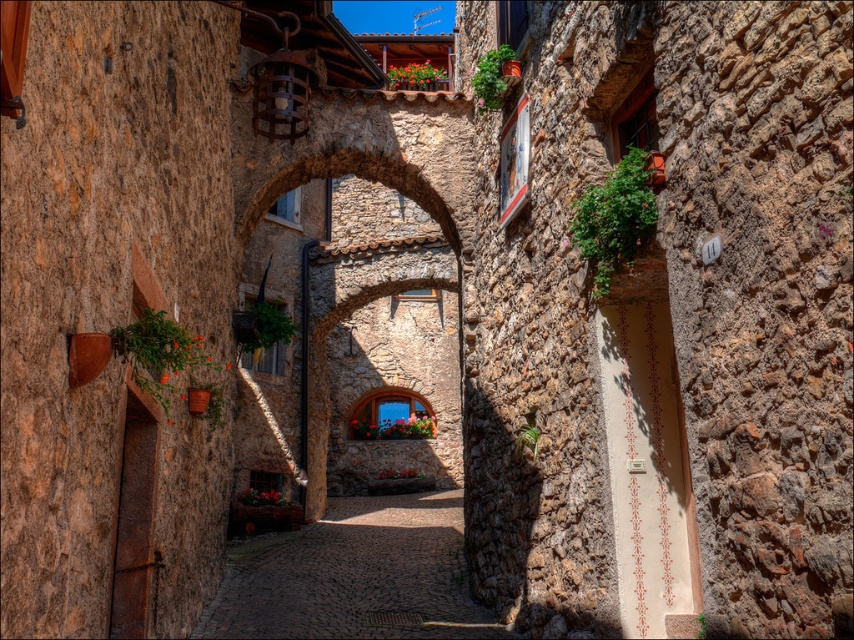
Is point (330, 397) closer to camera compared to point (247, 545)?

That is False.

Can you confirm if stone archway at center is taller than cobblestone path at center?

Yes, stone archway at center is taller than cobblestone path at center.

This screenshot has width=854, height=640. What do you see at coordinates (355, 323) in the screenshot? I see `stone archway at center` at bounding box center [355, 323].

Locate an element on the screen. The height and width of the screenshot is (640, 854). stone archway at center is located at coordinates (355, 323).